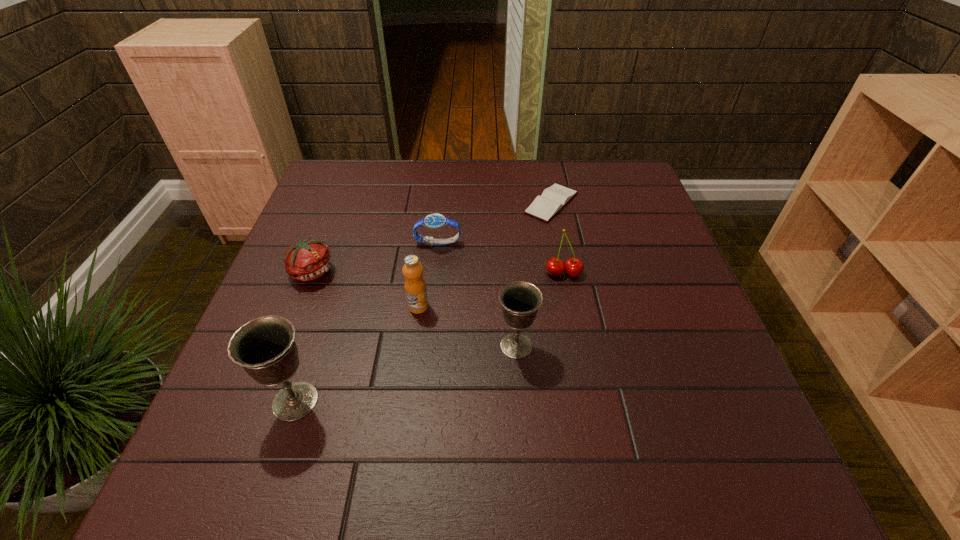
Locate an element on the screen. This screenshot has height=540, width=960. empty location between the third nearest object and the tomato is located at coordinates (366, 289).

Locate an element on the screen. This screenshot has width=960, height=540. free area in between the diary and the watch is located at coordinates (494, 223).

You are a GUI agent. You are given a task and a screenshot of the screen. Output one action in this format:
    pyautogui.click(x=<x>, y=<y>)
    Task: Click on the empty location between the fifth tallest object and the farthest object
    Image resolution: width=960 pixels, height=540 pixels.
    Given the screenshot: What is the action you would take?
    pyautogui.click(x=432, y=237)

Locate an element on the screen. unoccupied area between the fifth tallest object and the taller chalice is located at coordinates (304, 336).

Find the location of `free space between the third nearest object and the cherry`. free space between the third nearest object and the cherry is located at coordinates (491, 289).

The width and height of the screenshot is (960, 540). What are the coordinates of `free space between the shortest object and the fourth tallest object` in the screenshot? It's located at (558, 238).

Find the location of `free space between the fifth tallest object and the fourth tallest object`. free space between the fifth tallest object and the fourth tallest object is located at coordinates (438, 272).

The image size is (960, 540). I want to click on free spot between the orange juice and the farthest object, so click(x=485, y=255).

Find the location of a particular element. The image size is (960, 540). free space between the third object from right to left and the nearest object is located at coordinates (406, 374).

Where is `the closest object to the nearer chalice`? This screenshot has height=540, width=960. the closest object to the nearer chalice is located at coordinates (415, 286).